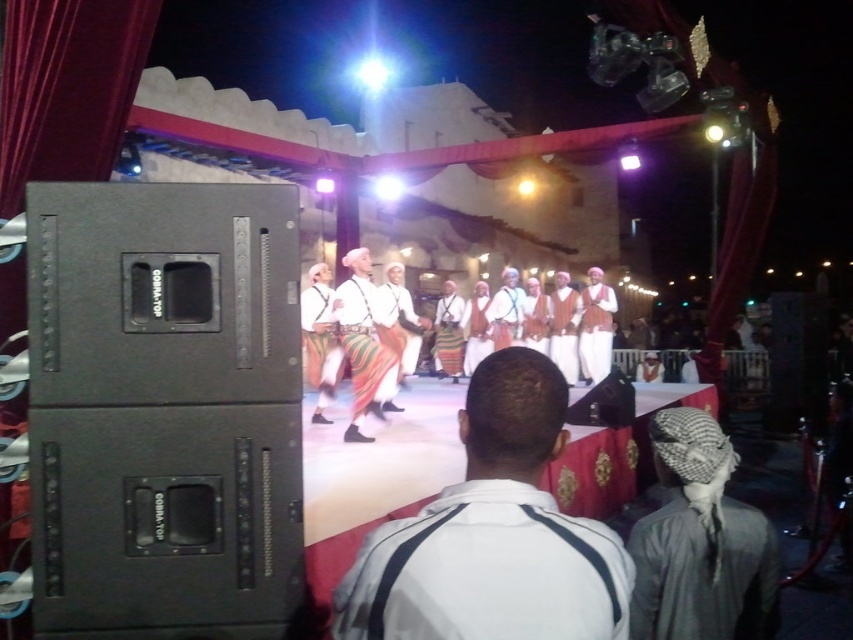
You are standing at the center of the stage and want to move towards the direction of the camera. Which point, point (492,474) or point (398,360), should you move towards to get closer to the camera?

You should move towards point (492,474) because it is closer to the camera than point (398,360).

You are a photographer at the event and want to capture a photo of both the dark gray fabric headscarf at center and the multicolored fabric pants at center in the same frame. Based on their positions, which one should you focus on first to ensure both are in the frame?

The dark gray fabric headscarf at center is to the right of multicolored fabric pants at center. To capture both in the same frame, focus on the multicolored fabric pants at center first, then adjust the camera to include the dark gray fabric headscarf at center to the right.